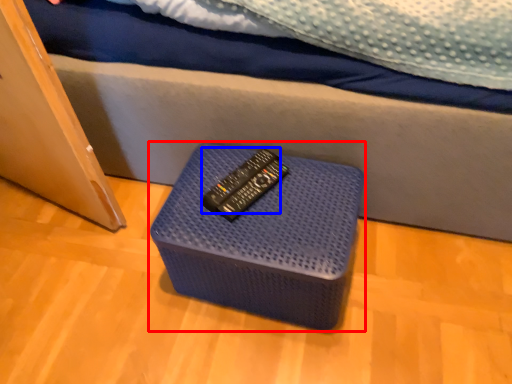
Question: Which of the following is the farthest to the observer, furniture (highlighted by a red box) or remote (highlighted by a blue box)?

Choices:
 (A) furniture
 (B) remote

Answer: (B)